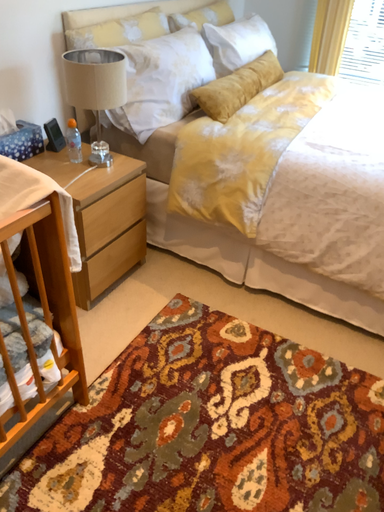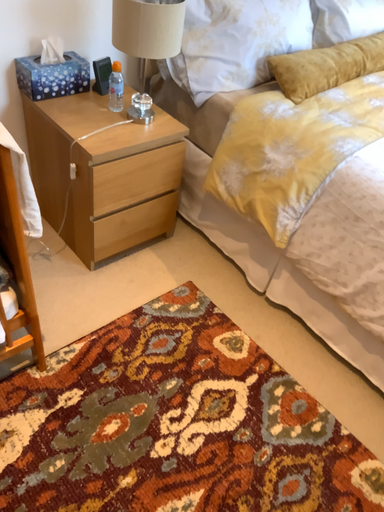
Question: How did the camera likely rotate when shooting the video?

Choices:
 (A) rotated right
 (B) rotated left

Answer: (B)